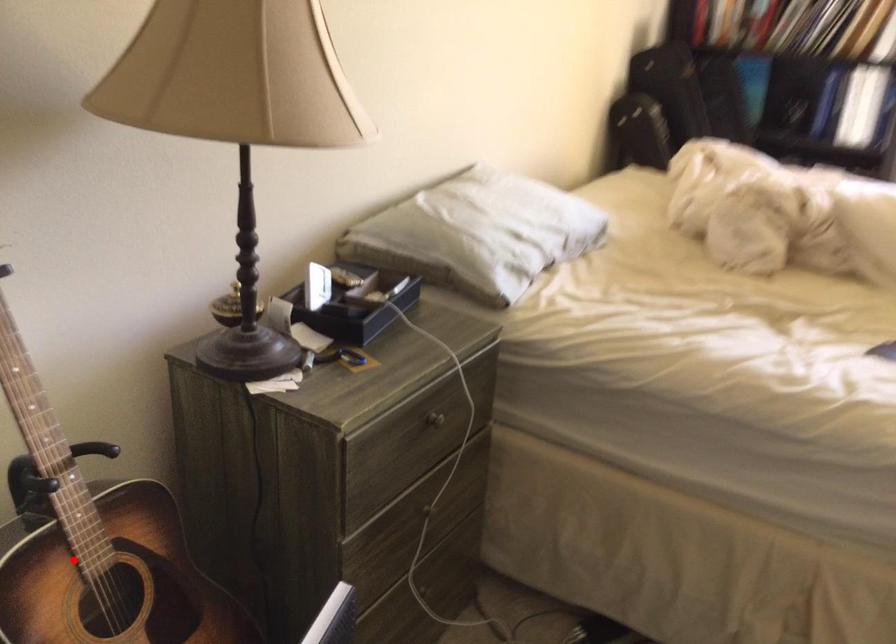
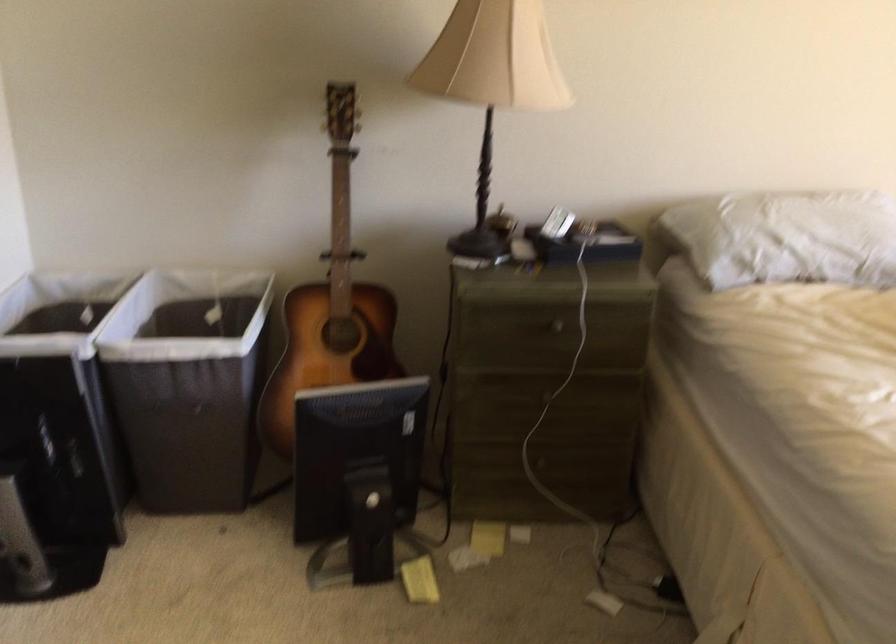
Locate, in the second image, the point that corresponds to the highlighted location in the first image.

(331, 303)